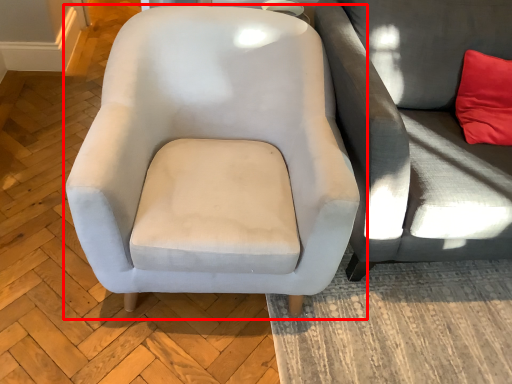
Question: From the image's perspective, where is chair (annotated by the red box) located in relation to studio couch in the image?

Choices:
 (A) above
 (B) below

Answer: (B)